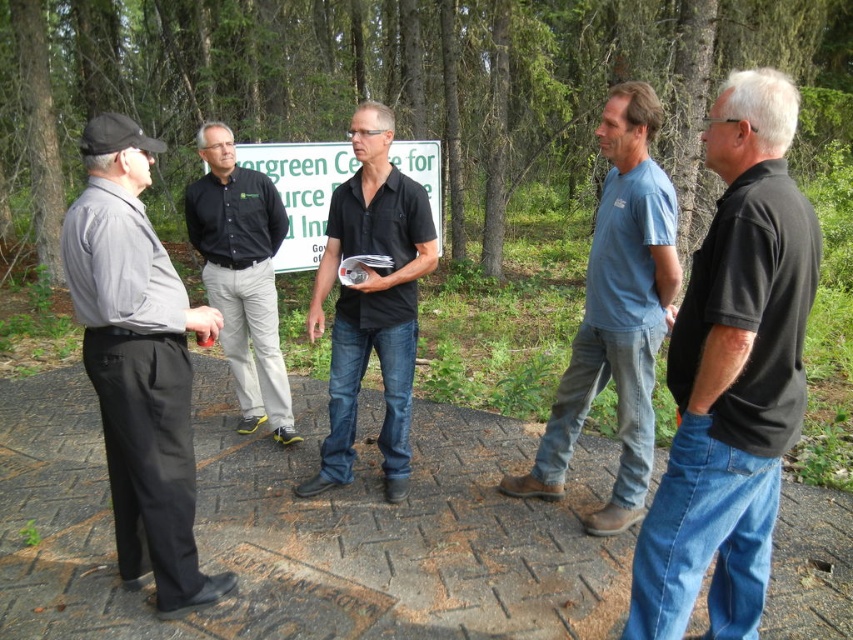
You are a photographer trying to capture a clear shot of the green plastic sign at center without the black cotton polo shirt at center blocking it. Based on their relative sizes, can you suggest a way to frame the shot so the sign is fully visible?

Since the black cotton polo shirt at center is thinner than the green plastic sign at center, you can position the camera so that the sign is framed wider than the shirt, allowing its full width to be captured without obstruction.

Based on the scene description, can you determine the spatial relationship between the gray matte shirt at left and the black smooth shirt at center?

The gray matte shirt at left is below the black smooth shirt at center.